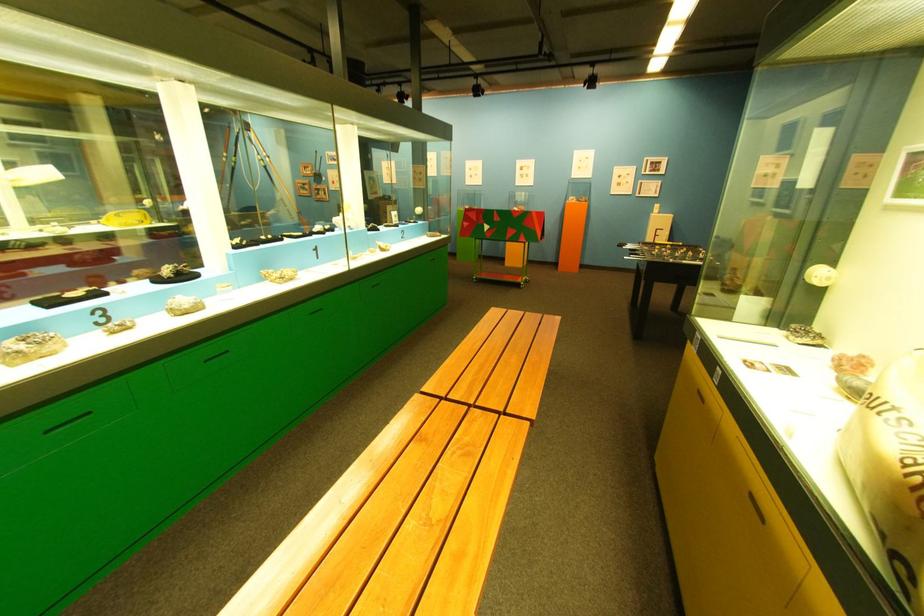
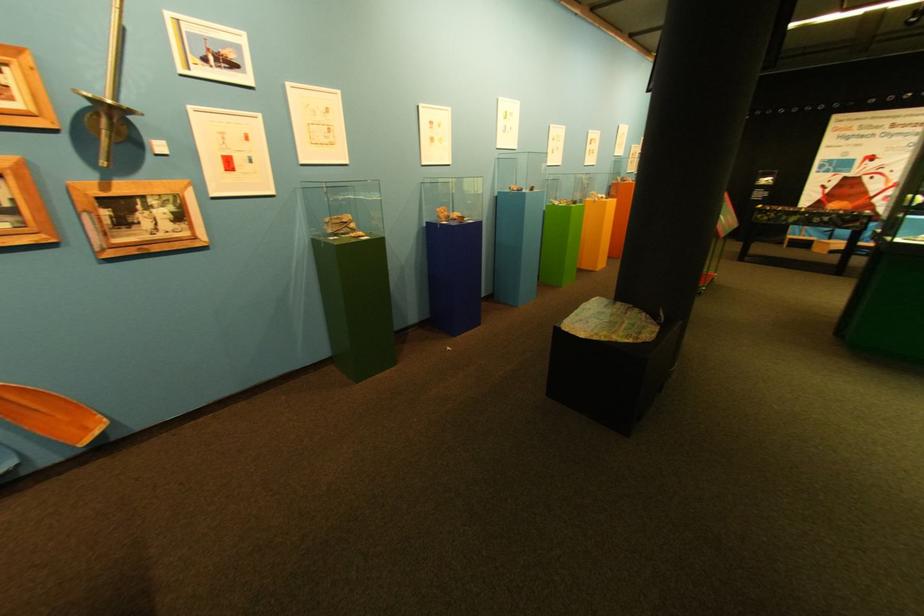
In the second image, find the point that corresponds to the point at 322,193 in the first image.

(18, 228)